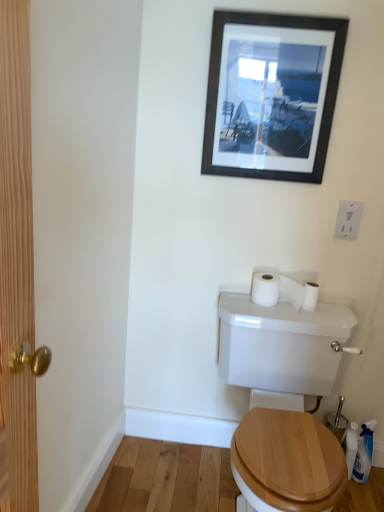
What do you see at coordinates (310, 296) in the screenshot? The width and height of the screenshot is (384, 512). I see `white matte toilet paper at upper right, positioned as the first toilet paper in right-to-left order` at bounding box center [310, 296].

You are a GUI agent. You are given a task and a screenshot of the screen. Output one action in this format:
    pyautogui.click(x=<x>, y=<y>)
    Task: Click on the white glossy toilet at center
    This screenshot has width=384, height=512.
    Given the screenshot: What is the action you would take?
    pyautogui.click(x=281, y=347)

This screenshot has width=384, height=512. What do you see at coordinates (289, 288) in the screenshot?
I see `white matte toilet paper at upper right, which is counted as the second toilet paper, starting from the right` at bounding box center [289, 288].

What do you see at coordinates (273, 96) in the screenshot?
I see `black matte picture frame at upper center` at bounding box center [273, 96].

Locate an element on the screen. The width and height of the screenshot is (384, 512). white plastic switch at upper right is located at coordinates (348, 219).

Which is more to the right, white plastic switch at upper right or white matte toilet paper at upper right, which is counted as the second toilet paper, starting from the right?

white plastic switch at upper right is more to the right.

Is white plastic switch at upper right aimed at white matte toilet paper at upper right, which is counted as the second toilet paper, starting from the right?

No, white plastic switch at upper right is not facing towards white matte toilet paper at upper right, which is counted as the second toilet paper, starting from the right.

From the picture: How distant is white plastic switch at upper right from white matte toilet paper at upper right, the first toilet paper from the left?

A distance of 10.99 inches exists between white plastic switch at upper right and white matte toilet paper at upper right, the first toilet paper from the left.

Which object is closer to the camera taking this photo, white plastic switch at upper right or white matte toilet paper at upper right, the first toilet paper from the left?

white matte toilet paper at upper right, the first toilet paper from the left.

Considering the sizes of white matte toilet paper at upper right, which is counted as the second toilet paper, starting from the right, and white matte toilet paper at upper right, positioned as the first toilet paper in right-to-left order, in the image, is white matte toilet paper at upper right, which is counted as the second toilet paper, starting from the right, wider or thinner than white matte toilet paper at upper right, positioned as the first toilet paper in right-to-left order,?

Considering their sizes, white matte toilet paper at upper right, which is counted as the second toilet paper, starting from the right, looks broader than white matte toilet paper at upper right, positioned as the first toilet paper in right-to-left order.

From a real-world perspective, between white matte toilet paper at upper right, which is counted as the second toilet paper, starting from the right, and white matte toilet paper at upper right, positioned as the first toilet paper in right-to-left order, who is vertically lower?

In real-world perspective, white matte toilet paper at upper right, positioned as the first toilet paper in right-to-left order, is lower.

Can white matte toilet paper at upper right, the 2th toilet paper positioned from the left, be found inside white matte toilet paper at upper right, which is counted as the second toilet paper, starting from the right?

Yes, white matte toilet paper at upper right, the 2th toilet paper positioned from the left, is surrounded by white matte toilet paper at upper right, which is counted as the second toilet paper, starting from the right.

Considering the positions of points (292, 298) and (313, 292), is point (292, 298) closer to camera compared to point (313, 292)?

No, (292, 298) is further to viewer.

Which object is more forward, white matte toilet paper at upper right, the 2th toilet paper positioned from the left, or white glossy toilet at center?

white glossy toilet at center is in front.

Considering the relative sizes of white matte toilet paper at upper right, the 2th toilet paper positioned from the left, and white glossy toilet at center in the image provided, is white matte toilet paper at upper right, the 2th toilet paper positioned from the left, shorter than white glossy toilet at center?

Correct, white matte toilet paper at upper right, the 2th toilet paper positioned from the left, is not as tall as white glossy toilet at center.

Considering the sizes of white matte toilet paper at upper right, positioned as the first toilet paper in right-to-left order, and white glossy toilet at center in the image, is white matte toilet paper at upper right, positioned as the first toilet paper in right-to-left order, wider or thinner than white glossy toilet at center?

Considering their sizes, white matte toilet paper at upper right, positioned as the first toilet paper in right-to-left order, looks slimmer than white glossy toilet at center.

Is point (309, 286) closer or farther from the camera than point (320, 308)?

Clearly, point (309, 286) is closer to the camera than point (320, 308).

Considering the sizes of white matte toilet paper at upper right, which is counted as the second toilet paper, starting from the right, and white glossy toilet at center in the image, is white matte toilet paper at upper right, which is counted as the second toilet paper, starting from the right, bigger or smaller than white glossy toilet at center?

Clearly, white matte toilet paper at upper right, which is counted as the second toilet paper, starting from the right, is smaller in size than white glossy toilet at center.

Is white matte toilet paper at upper right, the first toilet paper from the left, far away from white glossy toilet at center?

No, white matte toilet paper at upper right, the first toilet paper from the left, is not far away from white glossy toilet at center.

At what (x,y) coordinates should I click in order to perform the action: click on toilet below the white matte toilet paper at upper right, the first toilet paper from the left (from the image's perspective). Please return your answer as a coordinate pair (x, y). Image resolution: width=384 pixels, height=512 pixels. Looking at the image, I should click on (281, 347).

Does point (291, 297) come in front of point (354, 318)?

No, it is behind (354, 318).

From the image's perspective, would you say black matte picture frame at upper center is positioned over white matte toilet paper at upper right, the first toilet paper from the left?

Correct, black matte picture frame at upper center appears higher than white matte toilet paper at upper right, the first toilet paper from the left, in the image.

Is black matte picture frame at upper center facing away from white matte toilet paper at upper right, the first toilet paper from the left?

That's not correct — black matte picture frame at upper center is not looking away from white matte toilet paper at upper right, the first toilet paper from the left.

Image resolution: width=384 pixels, height=512 pixels. I want to click on toilet paper that is the 1st object located below the black matte picture frame at upper center (from the image's perspective), so click(x=289, y=288).

Considering the relative positions of black matte picture frame at upper center and white matte toilet paper at upper right, the first toilet paper from the left, in the image provided, is black matte picture frame at upper center behind white matte toilet paper at upper right, the first toilet paper from the left,?

No, black matte picture frame at upper center is in front of white matte toilet paper at upper right, the first toilet paper from the left.

Between white matte toilet paper at upper right, the 2th toilet paper positioned from the left, and white plastic switch at upper right, which one is positioned behind?

white matte toilet paper at upper right, the 2th toilet paper positioned from the left, is more distant.

Is white matte toilet paper at upper right, positioned as the first toilet paper in right-to-left order, placed right next to white plastic switch at upper right?

No, white matte toilet paper at upper right, positioned as the first toilet paper in right-to-left order, is not next to white plastic switch at upper right.

Locate an element on the screen. This screenshot has height=512, width=384. toilet paper behind the white plastic switch at upper right is located at coordinates (310, 296).

Is white plastic switch at upper right at the back of white matte toilet paper at upper right, positioned as the first toilet paper in right-to-left order?

white matte toilet paper at upper right, positioned as the first toilet paper in right-to-left order, is not turned away from white plastic switch at upper right.

Is white matte toilet paper at upper right, positioned as the first toilet paper in right-to-left order, next to white matte toilet paper at upper right, the first toilet paper from the left?

Indeed, white matte toilet paper at upper right, positioned as the first toilet paper in right-to-left order, and white matte toilet paper at upper right, the first toilet paper from the left, are beside each other and touching.

Is white matte toilet paper at upper right, the 2th toilet paper positioned from the left, taller or shorter than white matte toilet paper at upper right, the first toilet paper from the left?

In the image, white matte toilet paper at upper right, the 2th toilet paper positioned from the left, appears to be shorter than white matte toilet paper at upper right, the first toilet paper from the left.

Which object is further away from the camera, white matte toilet paper at upper right, positioned as the first toilet paper in right-to-left order, or white matte toilet paper at upper right, which is counted as the second toilet paper, starting from the right?

white matte toilet paper at upper right, positioned as the first toilet paper in right-to-left order, is behind.

Which is nearer, (312,295) or (300,288)?

The point (312,295) is more forward.

Locate an element on the screen. The width and height of the screenshot is (384, 512). electric outlet behind the white matte toilet paper at upper right, which is counted as the second toilet paper, starting from the right is located at coordinates (348, 219).

Find the location of a particular element. The width and height of the screenshot is (384, 512). toilet paper below the white matte toilet paper at upper right, which is counted as the second toilet paper, starting from the right (from a real-world perspective) is located at coordinates (310, 296).

Looking at the image, which one is located closer to white matte toilet paper at upper right, the first toilet paper from the left, black matte picture frame at upper center or white matte toilet paper at upper right, positioned as the first toilet paper in right-to-left order?

white matte toilet paper at upper right, positioned as the first toilet paper in right-to-left order, is positioned closer to the anchor white matte toilet paper at upper right, the first toilet paper from the left.

Which object lies nearer to the anchor point black matte picture frame at upper center, white plastic switch at upper right or white matte toilet paper at upper right, positioned as the first toilet paper in right-to-left order?

white plastic switch at upper right.

From the image, which object appears to be farther from white matte toilet paper at upper right, which is counted as the second toilet paper, starting from the right, black matte picture frame at upper center or white glossy toilet at center?

The object further to white matte toilet paper at upper right, which is counted as the second toilet paper, starting from the right, is black matte picture frame at upper center.

Looking at the image, which one is located further to white glossy toilet at center, white plastic switch at upper right or white matte toilet paper at upper right, the first toilet paper from the left?

Among the two, white plastic switch at upper right is located further to white glossy toilet at center.

Estimate the real-world distances between objects in this image. Which object is further from white matte toilet paper at upper right, the first toilet paper from the left, white plastic switch at upper right or white matte toilet paper at upper right, the 2th toilet paper positioned from the left?

Among the two, white plastic switch at upper right is located further to white matte toilet paper at upper right, the first toilet paper from the left.

Estimate the real-world distances between objects in this image. Which object is further from white plastic switch at upper right, white glossy toilet at center or white matte toilet paper at upper right, positioned as the first toilet paper in right-to-left order?

white glossy toilet at center is further to white plastic switch at upper right.

Estimate the real-world distances between objects in this image. Which object is further from white matte toilet paper at upper right, which is counted as the second toilet paper, starting from the right, white matte toilet paper at upper right, positioned as the first toilet paper in right-to-left order, or white plastic switch at upper right?

white plastic switch at upper right lies further to white matte toilet paper at upper right, which is counted as the second toilet paper, starting from the right, than the other object.

Looking at the image, which one is located further to black matte picture frame at upper center, white matte toilet paper at upper right, the first toilet paper from the left, or white plastic switch at upper right?

The object further to black matte picture frame at upper center is white matte toilet paper at upper right, the first toilet paper from the left.

Find the location of a particular element. The image size is (384, 512). toilet paper between black matte picture frame at upper center and white matte toilet paper at upper right, the 2th toilet paper positioned from the left, from top to bottom is located at coordinates (289, 288).

Identify the location of electric outlet that lies between black matte picture frame at upper center and white matte toilet paper at upper right, which is counted as the second toilet paper, starting from the right, from top to bottom. (348, 219).

Find the location of a particular element. electric outlet between black matte picture frame at upper center and white glossy toilet at center vertically is located at coordinates (348, 219).

Identify the location of toilet paper between white plastic switch at upper right and white matte toilet paper at upper right, the 2th toilet paper positioned from the left, in the vertical direction. (289, 288).